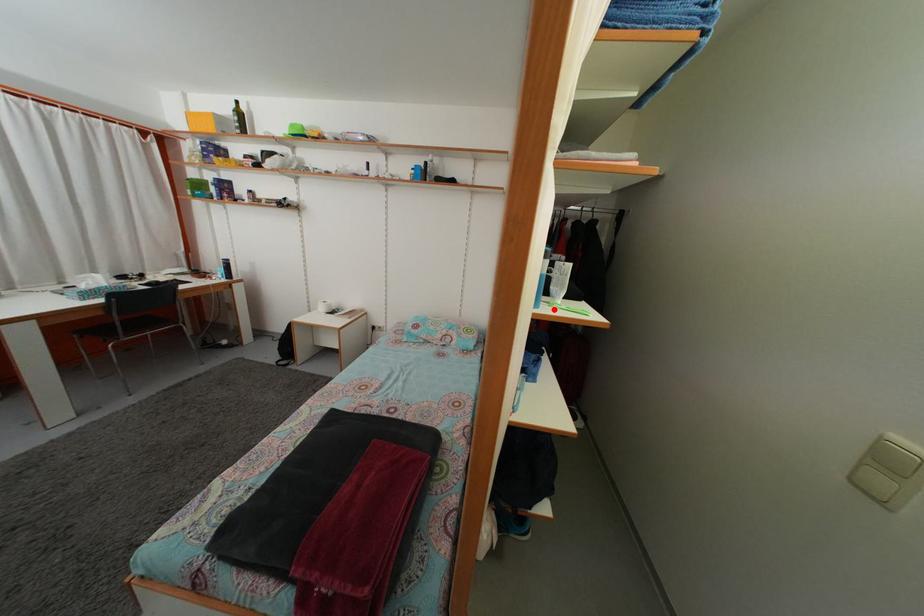
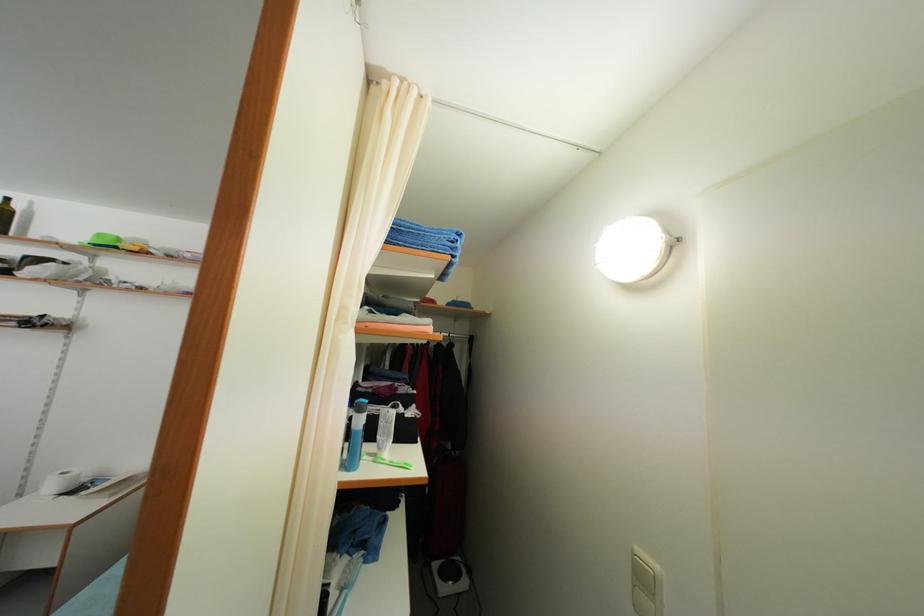
In the second image, find the point that corresponds to the highlighted location in the first image.

(381, 463)